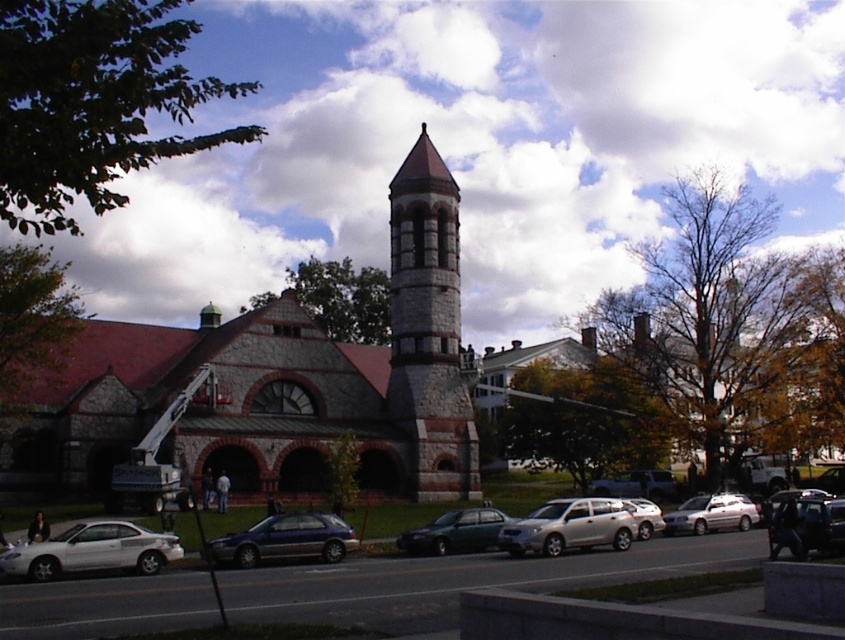
Between shiny black suv at center and metallic green sedan at center, which one appears on the left side from the viewer's perspective?

Positioned to the left is metallic green sedan at center.

Who is higher up, shiny black suv at center or metallic green sedan at center?

Positioned higher is shiny black suv at center.

Who is more forward, (818, 548) or (464, 509)?

Positioned in front is point (818, 548).

This screenshot has height=640, width=845. I want to click on shiny black suv at center, so click(x=807, y=525).

Between point (450, 422) and point (8, 557), which one is positioned in front?

Positioned in front is point (8, 557).

Between stone tower at center and white glossy sedan at lower left, which one has less height?

white glossy sedan at lower left

Locate an element on the screen. stone tower at center is located at coordinates (276, 381).

Which is behind, point (432, 440) or point (139, 525)?

The point (432, 440) is more distant.

Does stone brick tower at center have a greater height compared to white glossy sedan at lower left?

Indeed, stone brick tower at center has a greater height compared to white glossy sedan at lower left.

Locate an element on the screen. The width and height of the screenshot is (845, 640). stone brick tower at center is located at coordinates (429, 328).